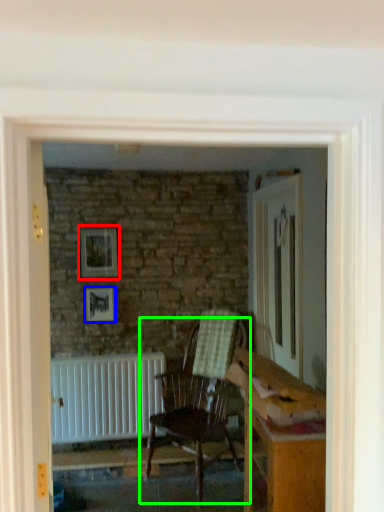
Question: Estimate the real-world distances between objects in this image. Which object is farther from picture frame (highlighted by a red box), picture frame (highlighted by a blue box) or chair (highlighted by a green box)?

Choices:
 (A) picture frame
 (B) chair

Answer: (B)